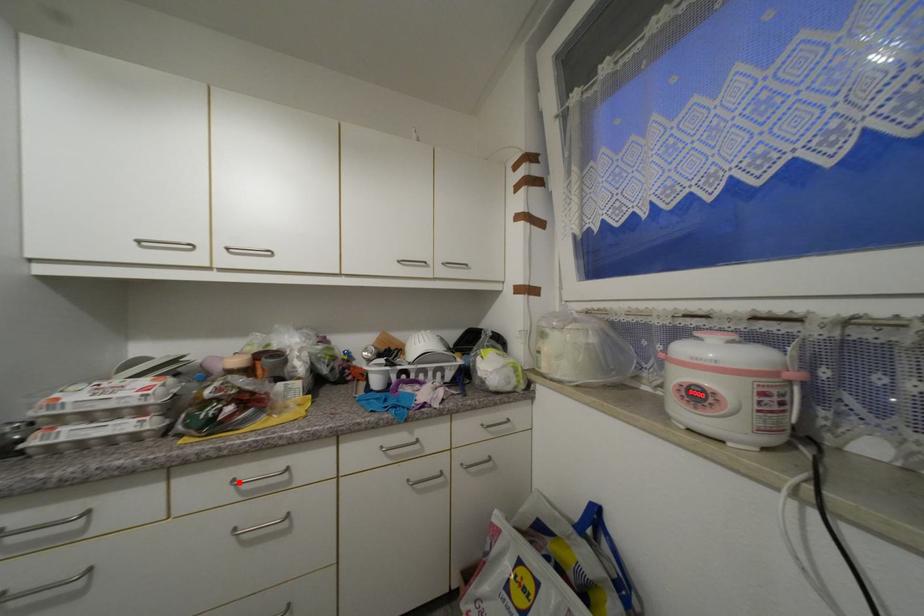
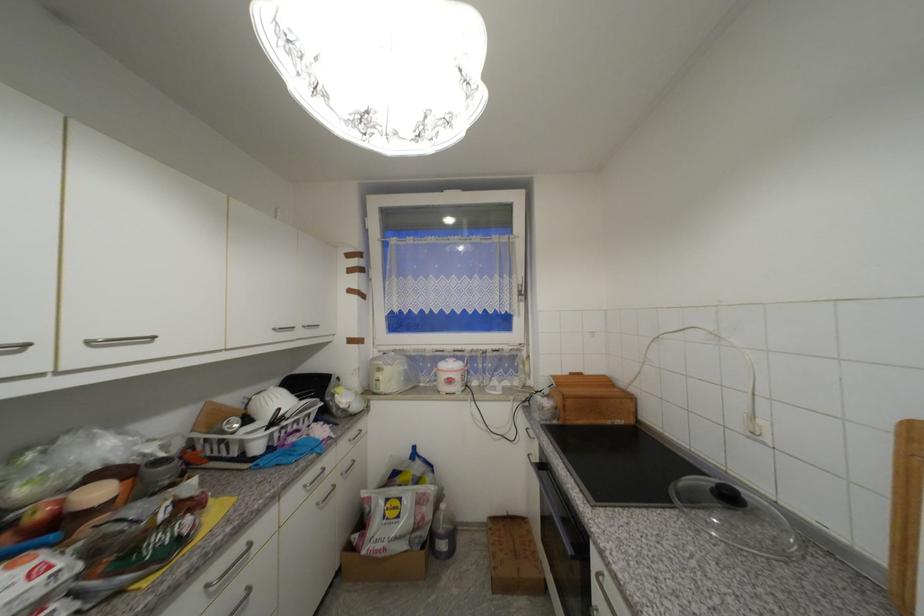
Question: I am providing you with two images of the same scene from different viewpoints. A red point is marked on the first image. At the location where the point appears in image 1, is it still visible in image 2?

Choices:
 (A) Yes
 (B) No

Answer: (A)